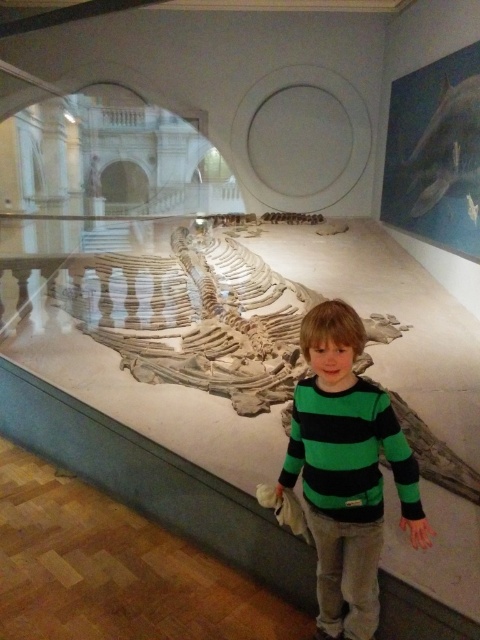
Is point (367, 532) more distant than point (446, 148)?

No, it is in front of (446, 148).

Which is behind, point (348, 628) or point (477, 204)?

Point (477, 204)

Locate an element on the screen. This screenshot has width=480, height=640. green striped sweater at center is located at coordinates (347, 470).